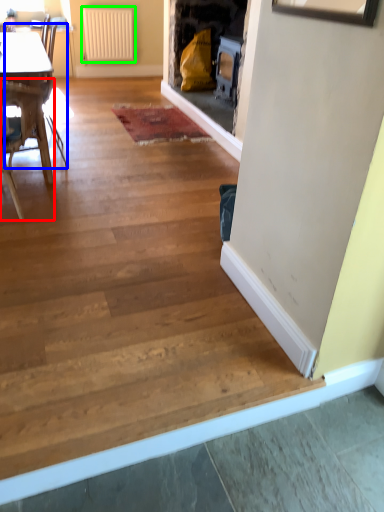
Question: Which is farther away from chair (highlighted by a red box)? armchair (highlighted by a blue box) or radiator (highlighted by a green box)?

Choices:
 (A) armchair
 (B) radiator

Answer: (B)